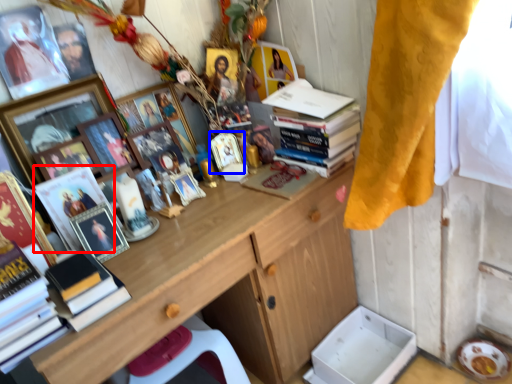
Question: Which point is closer to the camera, magazine (highlighted by a red box) or picture frame (highlighted by a blue box)?

Choices:
 (A) magazine
 (B) picture frame

Answer: (A)